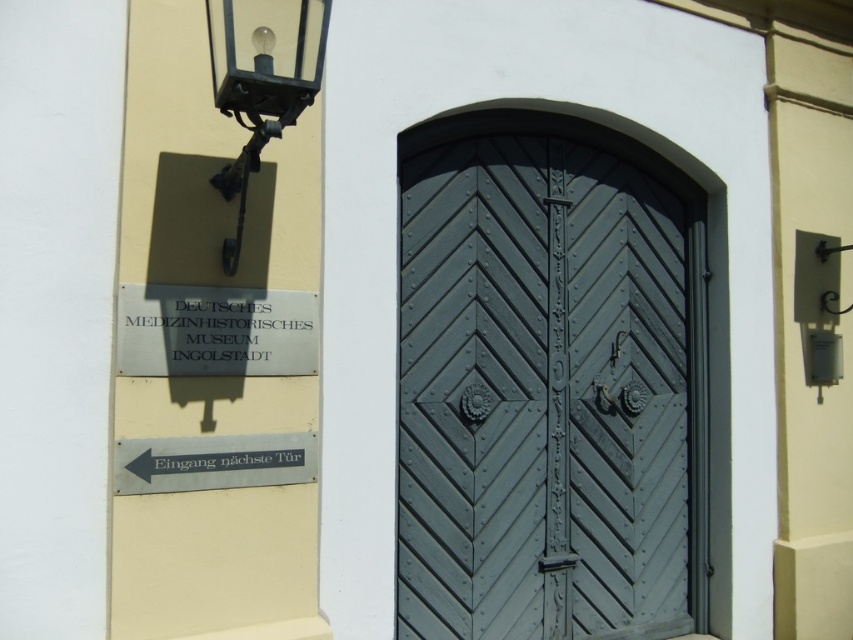
Question: Which point is farther to the camera?

Choices:
 (A) (231, 483)
 (B) (283, 60)
 (C) (146, 362)
 (D) (437, 522)

Answer: (D)

Question: Among these objects, which one is farthest from the camera?

Choices:
 (A) matte black lamp at upper left
 (B) matte gray wood door at center

Answer: (B)

Question: Can you confirm if matte gray wood door at center is bigger than silver metallic sign at upper left?

Choices:
 (A) no
 (B) yes

Answer: (B)

Question: Is matte black lamp at upper left to the right of silver metallic sign at lower left from the viewer's perspective?

Choices:
 (A) no
 (B) yes

Answer: (B)

Question: Can you confirm if matte gray wood door at center is smaller than matte black lamp at upper left?

Choices:
 (A) no
 (B) yes

Answer: (A)

Question: Estimate the real-world distances between objects in this image. Which object is closer to the matte black lamp at upper left?

Choices:
 (A) silver metallic sign at lower left
 (B) silver metallic sign at upper left
 (C) matte gray wood door at center

Answer: (B)